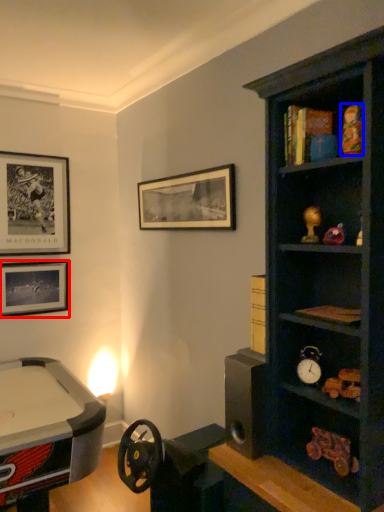
Question: Which of the following is the closest to the observer, picture frame (highlighted by a red box) or toy (highlighted by a blue box)?

Choices:
 (A) picture frame
 (B) toy

Answer: (B)